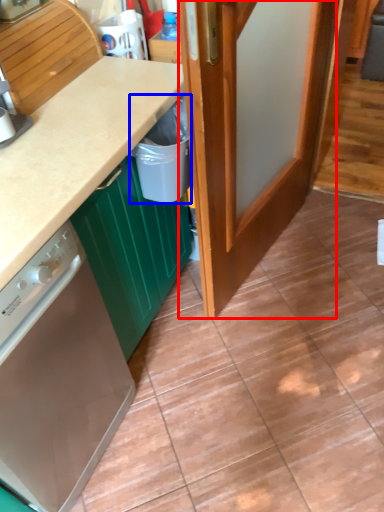
Question: Which object is closer to the camera taking this photo, door (highlighted by a red box) or recycling bin (highlighted by a blue box)?

Choices:
 (A) door
 (B) recycling bin

Answer: (A)